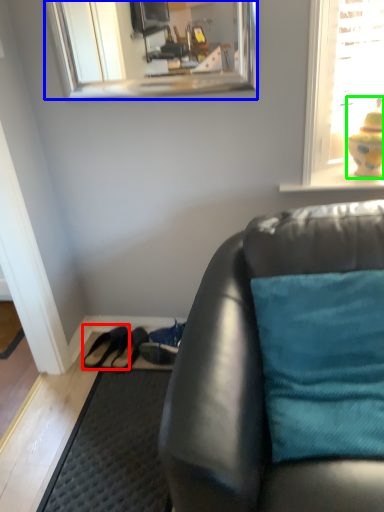
Question: Which is nearer to the shoe (highlighted by a red box)? mirror (highlighted by a blue box) or toy (highlighted by a green box).

Choices:
 (A) mirror
 (B) toy

Answer: (B)